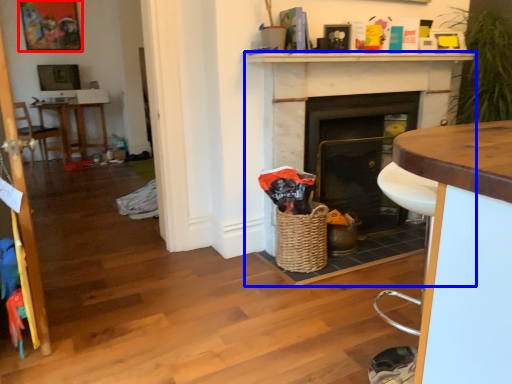
Question: Which point is further to the camera, picture frame (highlighted by a red box) or fireplace (highlighted by a blue box)?

Choices:
 (A) picture frame
 (B) fireplace

Answer: (A)